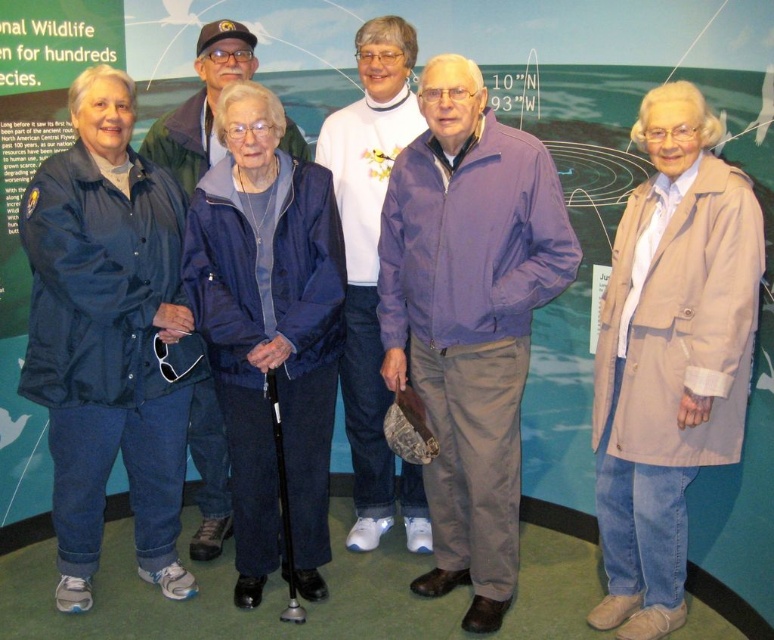
Question: Is matte blue jacket at left wider than beige fabric coat at center?

Choices:
 (A) yes
 (B) no

Answer: (A)

Question: Which point is closer to the camera?

Choices:
 (A) pyautogui.click(x=516, y=496)
 (B) pyautogui.click(x=358, y=273)

Answer: (A)

Question: Can you confirm if beige fabric coat at center is positioned to the right of white matte sweater at center?

Choices:
 (A) no
 (B) yes

Answer: (B)

Question: Estimate the real-world distances between objects in this image. Which object is closer to the white matte sweater at center?

Choices:
 (A) purple fabric jacket at center
 (B) matte blue jacket at left
 (C) brushed metal jacket at upper left
 (D) beige fabric coat at center

Answer: (A)

Question: Can you confirm if purple fabric jacket at center is positioned to the right of brushed metal jacket at upper left?

Choices:
 (A) yes
 (B) no

Answer: (A)

Question: Which object appears closest to the camera in this image?

Choices:
 (A) brushed metal jacket at upper left
 (B) white matte sweater at center
 (C) purple fabric jacket at center
 (D) matte blue jacket at left

Answer: (C)